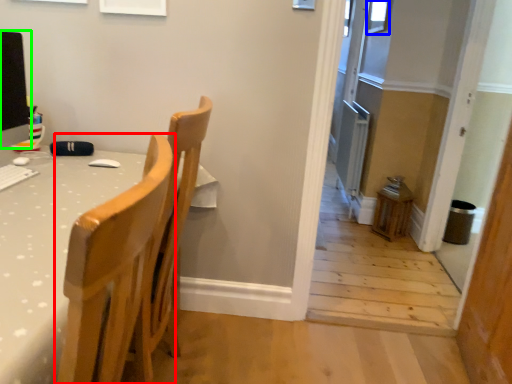
Question: Which object is the closest to the chair (highlighted by a red box)? Choose among these: window (highlighted by a blue box) or computer monitor (highlighted by a green box).

Choices:
 (A) window
 (B) computer monitor

Answer: (B)